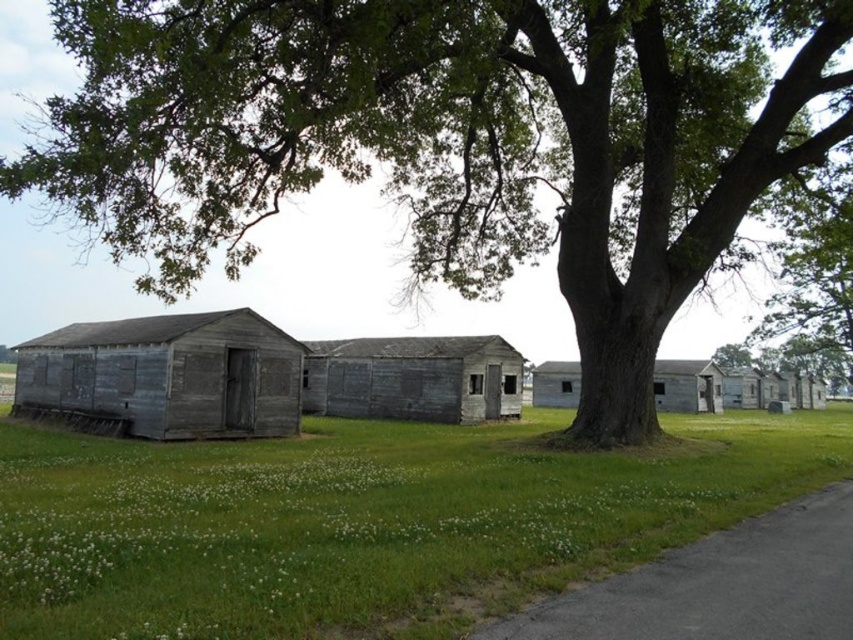
Question: Is green leafy tree at center positioned before weathered wood hut at center?

Choices:
 (A) yes
 (B) no

Answer: (A)

Question: Which object is the farthest from the green leafy tree at center?

Choices:
 (A) weathered wood hut at center
 (B) weathered wood hut at left
 (C) wooden hut at center

Answer: (C)

Question: Which of these objects is positioned closest to the weathered wood hut at left?

Choices:
 (A) green grass at lower left
 (B) wooden hut at center

Answer: (A)

Question: Is the position of weathered wood hut at left less distant than that of weathered wood hut at center?

Choices:
 (A) no
 (B) yes

Answer: (B)

Question: Which of the following is the closest to the observer?

Choices:
 (A) pos(676,401)
 (B) pos(323,528)
 (C) pos(254,369)
 (D) pos(432,369)

Answer: (B)

Question: Is green grass at lower left closer to the viewer compared to weathered wood hut at center?

Choices:
 (A) yes
 (B) no

Answer: (A)